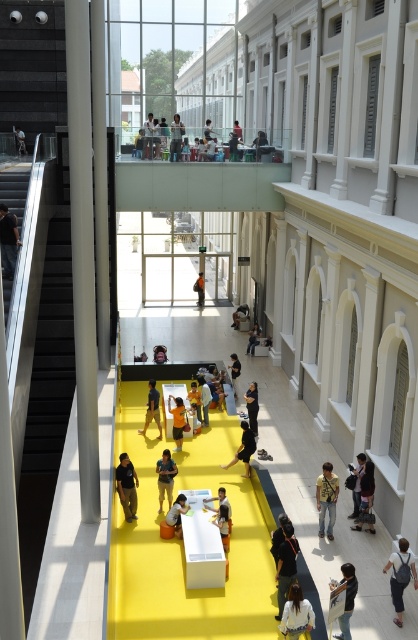
Where is `dark gray fabric shirt at lower right`? dark gray fabric shirt at lower right is located at coordinates (346, 600).

Is point (344, 618) behind point (231, 508)?

No.

Where is `dark gray fabric shirt at lower right`? This screenshot has width=418, height=640. dark gray fabric shirt at lower right is located at coordinates tap(346, 600).

Which is more to the left, dark gray backpack at lower right or light brown wooden chair at upper center?

light brown wooden chair at upper center is more to the left.

How distant is dark gray backpack at lower right from light brown wooden chair at upper center?

dark gray backpack at lower right and light brown wooden chair at upper center are 17.01 meters apart.

Is point (399, 570) positioned behind point (175, 160)?

No, (399, 570) is closer to viewer.

You are a GUI agent. You are given a task and a screenshot of the screen. Output one action in this format:
    pyautogui.click(x=<x>, y=<y>)
    Task: Click on the dark gray backpack at lower right
    This screenshot has height=640, width=418.
    Given the screenshot: What is the action you would take?
    pyautogui.click(x=400, y=577)

Looking at this image, between dark gray fabric at lower center and dark gray sweater at lower right, which one has less height?

With less height is dark gray sweater at lower right.

Does point (124, 500) come in front of point (356, 484)?

Yes.

Is point (124, 506) in front of point (352, 474)?

Yes, it is.

Locate an element on the screen. Image resolution: width=418 pixels, height=640 pixels. dark gray fabric at lower center is located at coordinates (127, 486).